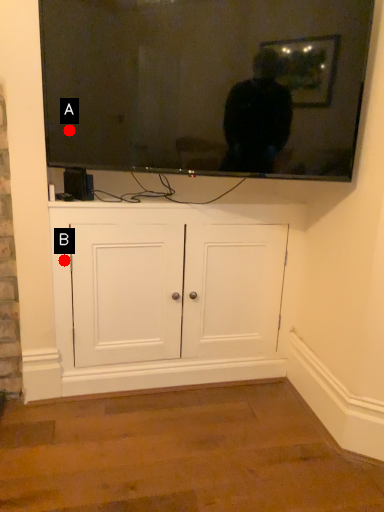
Question: Two points are circled on the image, labeled by A and B beside each circle. Which point is closer to the camera?

Choices:
 (A) A is closer
 (B) B is closer

Answer: (A)